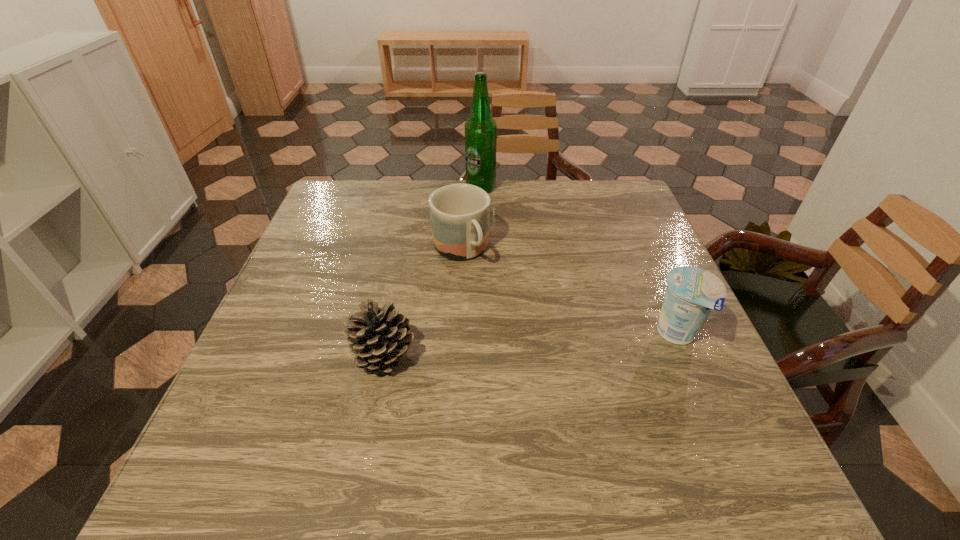
In order to click on the third closest object to the yogurt in this screenshot , I will do `click(480, 128)`.

Find the location of a particular element. object that is the second nearest to the mug is located at coordinates (379, 338).

This screenshot has height=540, width=960. Find the location of `blank space that satisfies the following two spatial constraints: 1. on the back side of the second farthest object; 2. on the left side of the leftmost object`. blank space that satisfies the following two spatial constraints: 1. on the back side of the second farthest object; 2. on the left side of the leftmost object is located at coordinates (405, 250).

I want to click on free region that satisfies the following two spatial constraints: 1. on the back side of the pinecone; 2. on the left side of the second farthest object, so click(x=405, y=250).

What are the coordinates of `blank space that satisfies the following two spatial constraints: 1. on the front side of the yogurt; 2. on the left side of the farthest object` in the screenshot? It's located at 481,334.

Locate an element on the screen. blank area in the image that satisfies the following two spatial constraints: 1. on the back side of the second farthest object; 2. on the left side of the tallest object is located at coordinates tap(464, 188).